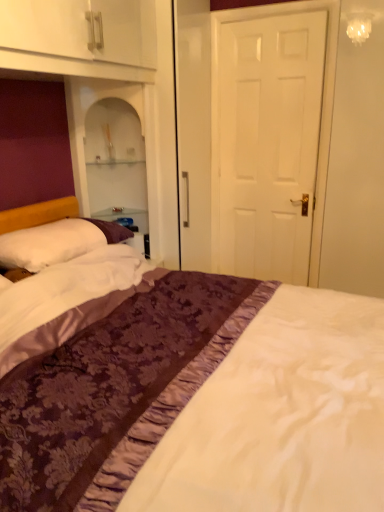
You are a GUI agent. You are given a task and a screenshot of the screen. Output one action in this format:
    pyautogui.click(x=<x>, y=<y>)
    Task: Click on the vacant area on top of white matte door at center (from a real-world perspective)
    This screenshot has height=512, width=384.
    Given the screenshot: What is the action you would take?
    pyautogui.click(x=270, y=15)